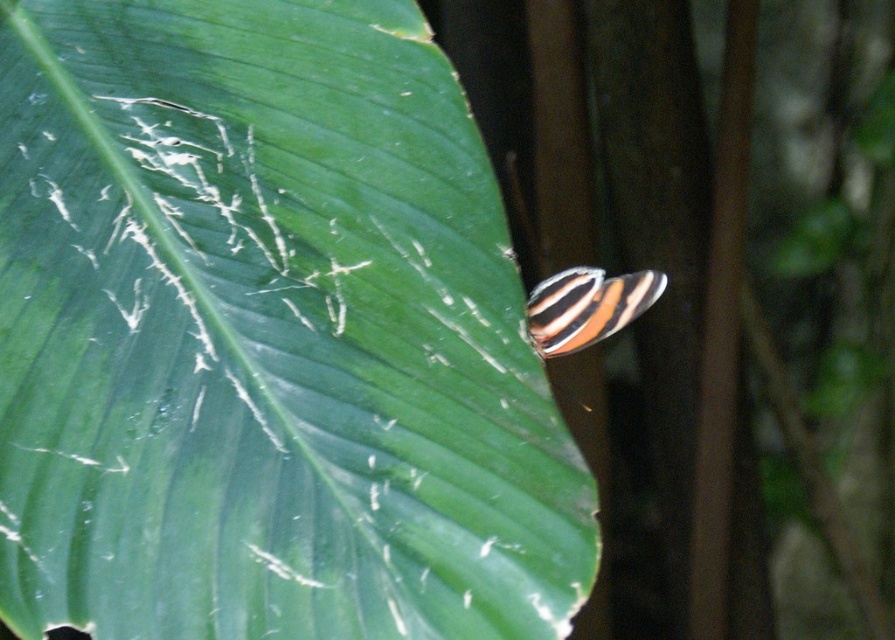
Question: Which point is farther to the camera?

Choices:
 (A) (160, 435)
 (B) (612, 324)

Answer: (B)

Question: Which point is closer to the camera?

Choices:
 (A) (240, 545)
 (B) (578, 300)

Answer: (A)

Question: Observing the image, what is the correct spatial positioning of green matte leaf at upper left in reference to striped winged insect at center?

Choices:
 (A) above
 (B) below

Answer: (B)

Question: Is green matte leaf at upper left below striped winged insect at center?

Choices:
 (A) no
 (B) yes

Answer: (B)

Question: Does green matte leaf at upper left have a greater width compared to striped winged insect at center?

Choices:
 (A) yes
 (B) no

Answer: (A)

Question: Which object appears closest to the camera in this image?

Choices:
 (A) striped winged insect at center
 (B) green matte leaf at upper left

Answer: (B)